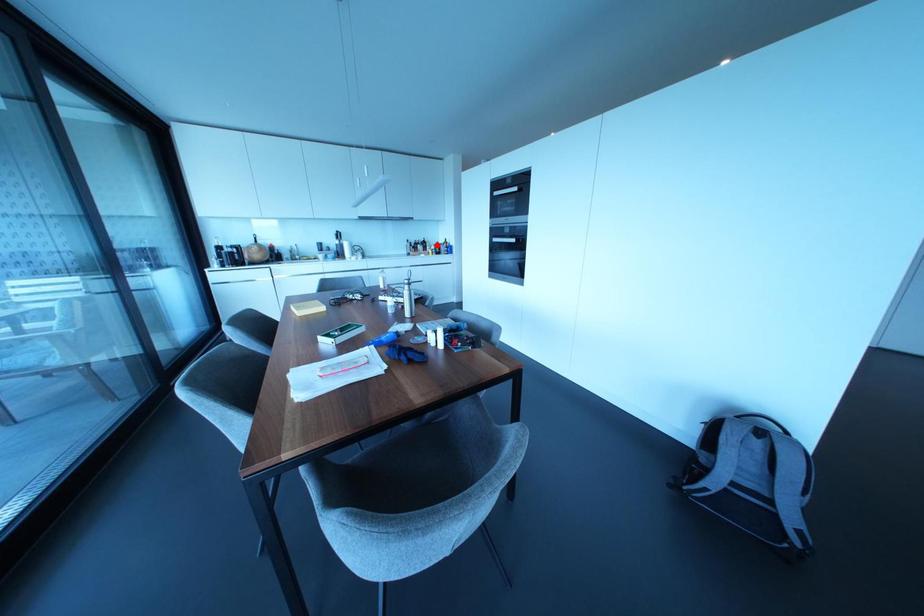
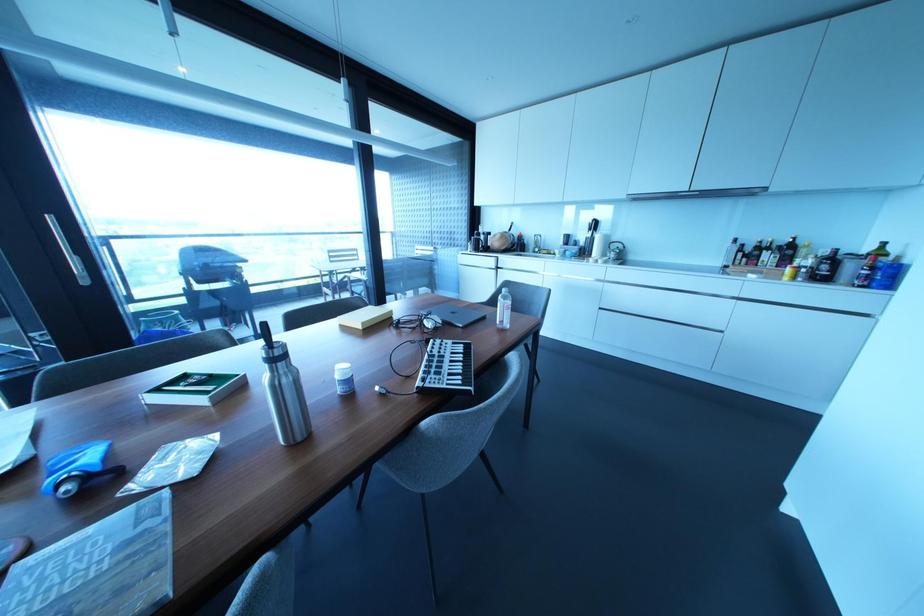
Where in the second image is the point corresponding to the highlighted location from the first image?

(833, 257)